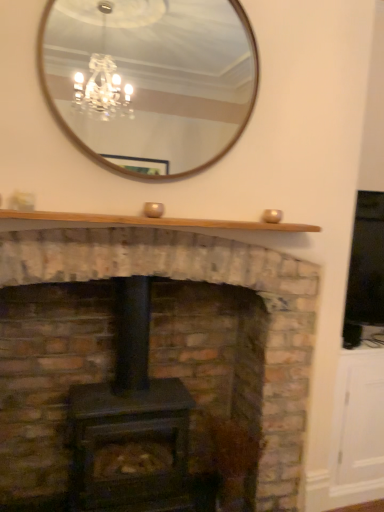
Locate an element on the screen. The image size is (384, 512). matte black wood burning stove at center is located at coordinates (132, 426).

Is brick fireplace at center next to wooden-framed mirror at upper center?

No, brick fireplace at center is not in contact with wooden-framed mirror at upper center.

From the image's perspective, which is below, brick fireplace at center or wooden-framed mirror at upper center?

brick fireplace at center is shown below in the image.

In the image, there is a wooden-framed mirror at upper center. At what (x,y) coordinates should I click in order to perform the action: click on fireplace below it (from the image's perspective). Please return your answer as a coordinate pair (x, y). This screenshot has width=384, height=512. Looking at the image, I should click on (199, 280).

Who is bigger, brick fireplace at center or wooden-framed mirror at upper center?

brick fireplace at center is bigger.

Would you say matte black wood burning stove at center is part of natural wood mantle at upper center's contents?

No.

Considering the sizes of natural wood mantle at upper center and matte black wood burning stove at center in the image, is natural wood mantle at upper center wider or thinner than matte black wood burning stove at center?

Considering their sizes, natural wood mantle at upper center looks slimmer than matte black wood burning stove at center.

From the image's perspective, is natural wood mantle at upper center located above or below matte black wood burning stove at center?

Based on their image positions, natural wood mantle at upper center is located above matte black wood burning stove at center.

Which object is positioned more to the right, natural wood mantle at upper center or matte black wood burning stove at center?

Positioned to the right is natural wood mantle at upper center.

From a real-world perspective, is matte black wood burning stove at center beneath wooden-framed mirror at upper center?

Yes, from a real-world perspective, matte black wood burning stove at center is under wooden-framed mirror at upper center.

Does matte black wood burning stove at center have a greater width compared to wooden-framed mirror at upper center?

Yes.

Could you tell me if matte black wood burning stove at center is facing wooden-framed mirror at upper center?

No, matte black wood burning stove at center does not turn towards wooden-framed mirror at upper center.

Is matte black wood burning stove at center next to wooden-framed mirror at upper center?

No, matte black wood burning stove at center is not with wooden-framed mirror at upper center.

Choose the correct answer: Is brick fireplace at center inside matte black wood burning stove at center or outside it?

brick fireplace at center cannot be found inside matte black wood burning stove at center.

From the picture: Is brick fireplace at center taller or shorter than matte black wood burning stove at center?

brick fireplace at center is taller than matte black wood burning stove at center.

Does brick fireplace at center come in front of matte black wood burning stove at center?

Yes, it is in front of matte black wood burning stove at center.

Where is `fireplace that is in front of the matte black wood burning stove at center`? The height and width of the screenshot is (512, 384). fireplace that is in front of the matte black wood burning stove at center is located at coordinates (199, 280).

Identify the location of wood burning stove on the left of brick fireplace at center. Image resolution: width=384 pixels, height=512 pixels. (132, 426).

From the image's perspective, which is below, matte black wood burning stove at center or brick fireplace at center?

From the image's view, matte black wood burning stove at center is below.

Would you say matte black wood burning stove at center is to the left or to the right of brick fireplace at center in the picture?

matte black wood burning stove at center is positioned on brick fireplace at center's left side.

Can brick fireplace at center be found inside matte black wood burning stove at center?

No, brick fireplace at center is not a part of matte black wood burning stove at center.

Identify the location of mirror that appears on the left of natural wood mantle at upper center. The height and width of the screenshot is (512, 384). (150, 80).

Between natural wood mantle at upper center and wooden-framed mirror at upper center, which one has smaller width?

Thinner between the two is wooden-framed mirror at upper center.

From the image's perspective, would you say natural wood mantle at upper center is shown under wooden-framed mirror at upper center?

Yes, from the image's perspective, natural wood mantle at upper center is beneath wooden-framed mirror at upper center.

Is natural wood mantle at upper center to the left of wooden-framed mirror at upper center from the viewer's perspective?

No, natural wood mantle at upper center is not to the left of wooden-framed mirror at upper center.

Visually, is matte black wood burning stove at center positioned to the left or to the right of natural wood mantle at upper center?

matte black wood burning stove at center is positioned on natural wood mantle at upper center's left side.

Is matte black wood burning stove at center facing towards natural wood mantle at upper center?

No.

I want to click on wood burning stove behind the natural wood mantle at upper center, so pos(132,426).

Is the depth of matte black wood burning stove at center less than that of natural wood mantle at upper center?

No, matte black wood burning stove at center is further to the viewer.

You are a GUI agent. You are given a task and a screenshot of the screen. Output one action in this format:
    pyautogui.click(x=<x>, y=<y>)
    Task: Click on the mirror that appears above the brick fireplace at center (from a real-world perspective)
    Image resolution: width=384 pixels, height=512 pixels.
    Given the screenshot: What is the action you would take?
    pyautogui.click(x=150, y=80)

This screenshot has width=384, height=512. I want to click on wood burning stove below the natural wood mantle at upper center (from the image's perspective), so click(132, 426).

From the image, which object appears to be farther from natural wood mantle at upper center, brick fireplace at center or wooden-framed mirror at upper center?

Among the two, wooden-framed mirror at upper center is located further to natural wood mantle at upper center.

Looking at the image, which one is located further to matte black wood burning stove at center, brick fireplace at center or natural wood mantle at upper center?

Among the two, natural wood mantle at upper center is located further to matte black wood burning stove at center.

Considering their positions, is natural wood mantle at upper center positioned further to brick fireplace at center than wooden-framed mirror at upper center?

Among the two, wooden-framed mirror at upper center is located further to brick fireplace at center.

Considering their positions, is natural wood mantle at upper center positioned closer to brick fireplace at center than matte black wood burning stove at center?

natural wood mantle at upper center.

Based on their spatial positions, is natural wood mantle at upper center or wooden-framed mirror at upper center closer to matte black wood burning stove at center?

natural wood mantle at upper center is closer to matte black wood burning stove at center.

From the image, which object appears to be nearer to natural wood mantle at upper center, wooden-framed mirror at upper center or matte black wood burning stove at center?

Based on the image, matte black wood burning stove at center appears to be nearer to natural wood mantle at upper center.

Looking at this image, from the image, which object appears to be nearer to matte black wood burning stove at center, brick fireplace at center or wooden-framed mirror at upper center?

Among the two, brick fireplace at center is located nearer to matte black wood burning stove at center.

Which object lies nearer to the anchor point matte black wood burning stove at center, wooden-framed mirror at upper center or brick fireplace at center?

Among the two, brick fireplace at center is located nearer to matte black wood burning stove at center.

Locate an element on the screen. fireplace between wooden-framed mirror at upper center and matte black wood burning stove at center in the vertical direction is located at coordinates (199, 280).

I want to click on mantle between wooden-framed mirror at upper center and brick fireplace at center from top to bottom, so click(156, 221).

The image size is (384, 512). I want to click on mantle between wooden-framed mirror at upper center and matte black wood burning stove at center in the up-down direction, so click(156, 221).

Image resolution: width=384 pixels, height=512 pixels. What are the coordinates of `fireplace between natural wood mantle at upper center and matte black wood burning stove at center in the up-down direction` in the screenshot? It's located at (199, 280).